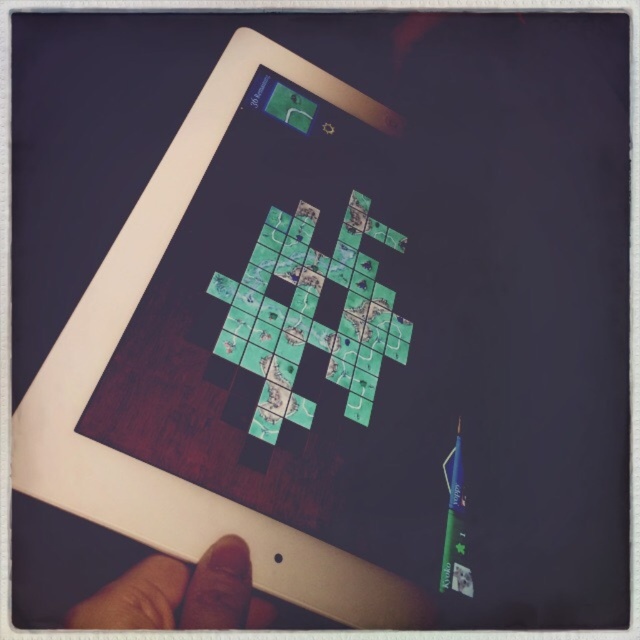
Question: Which object is closer to the camera taking this photo?

Choices:
 (A) green matte puzzle pieces at center
 (B) brown skin at lower left

Answer: (B)

Question: From the image, what is the correct spatial relationship of green matte puzzle pieces at center in relation to brown skin at lower left?

Choices:
 (A) right
 (B) left

Answer: (A)

Question: Is the position of green matte puzzle pieces at center more distant than that of brown skin at lower left?

Choices:
 (A) yes
 (B) no

Answer: (A)

Question: Among these objects, which one is nearest to the camera?

Choices:
 (A) green matte puzzle pieces at center
 (B) brown skin at lower left

Answer: (B)

Question: Is green matte puzzle pieces at center to the left of brown skin at lower left from the viewer's perspective?

Choices:
 (A) no
 (B) yes

Answer: (A)